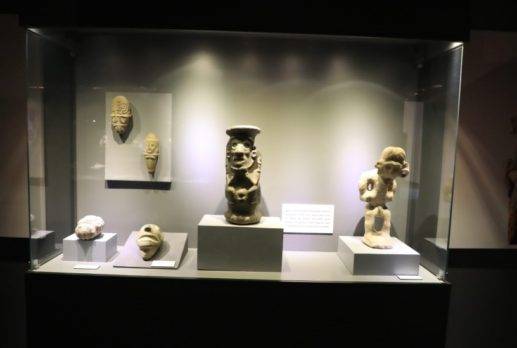
Identify the location of angled display stands. This screenshot has height=348, width=517. (119, 159), (172, 245).